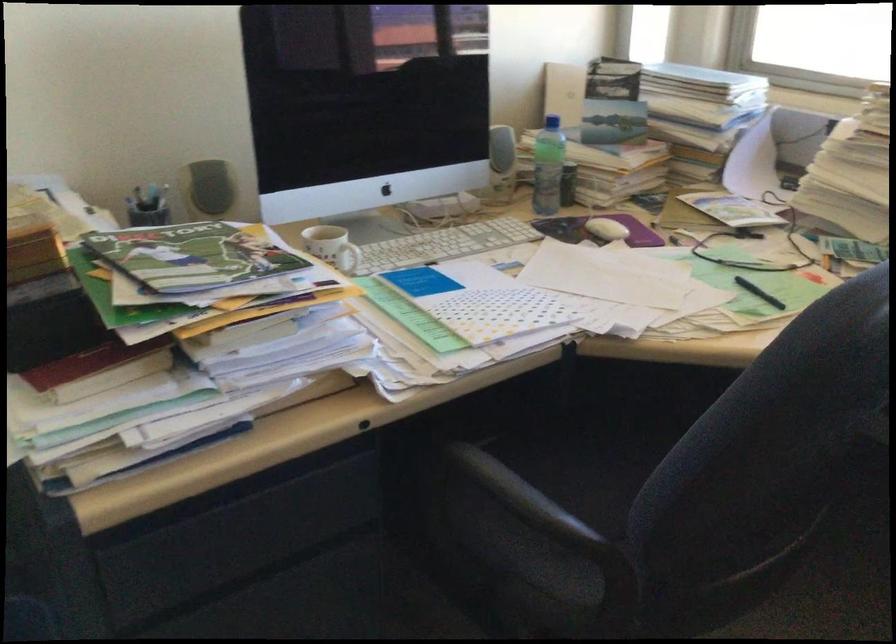
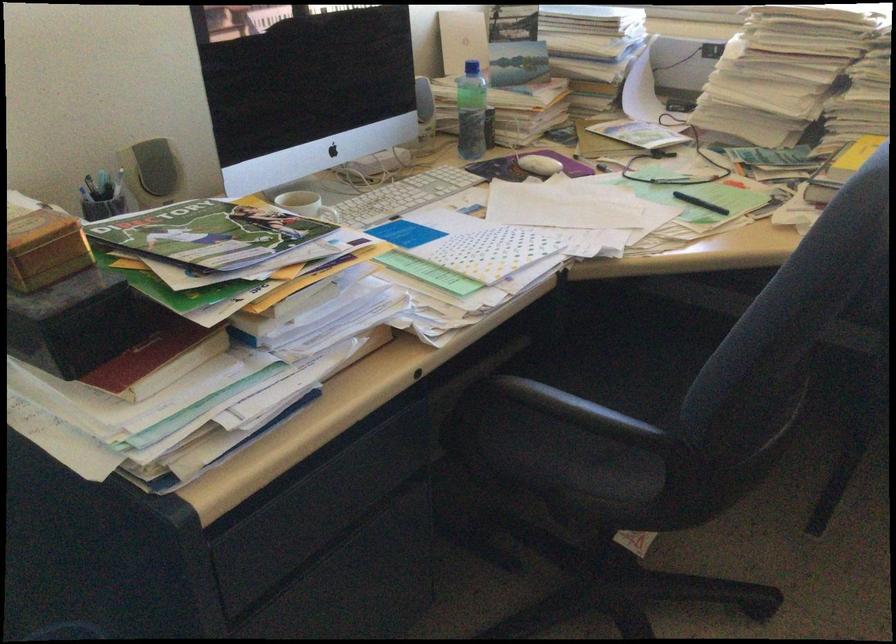
The point at (371, 251) is marked in the first image. Where is the corresponding point in the second image?

(334, 216)